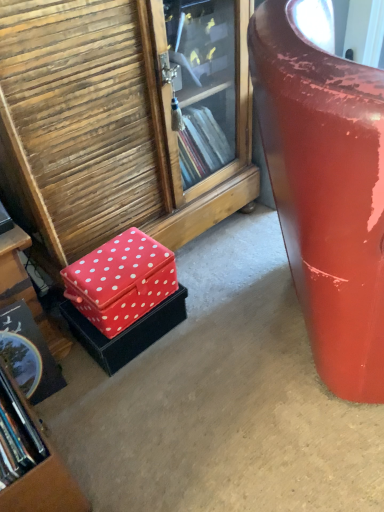
In order to click on vacant space to the left of glossy red suitcase at right in this screenshot , I will do `click(185, 364)`.